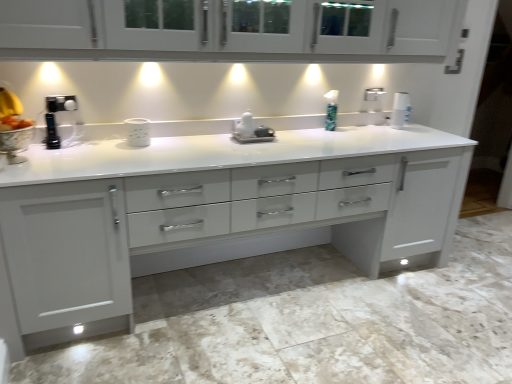
Find the location of a particular element. green plastic soap dispenser at center is located at coordinates (331, 110).

Describe the element at coordinates (232, 30) in the screenshot. I see `white glossy cabinet at upper center` at that location.

Find the location of `white glossy cabinet at upper center`. white glossy cabinet at upper center is located at coordinates (232, 30).

What is the approximate width of white glossy mug at center, the 1th appliance in the front-to-back sequence?

14.71 centimeters.

The width and height of the screenshot is (512, 384). Identify the location of white glossy paper towel at upper right. (400, 110).

Do you think white glossy coffee maker at center, which ranks as the 2th appliance in left-to-right order, is within white glossy countertop at center, or outside of it?

white glossy coffee maker at center, which ranks as the 2th appliance in left-to-right order, is inside white glossy countertop at center.

The height and width of the screenshot is (384, 512). I want to click on the 2nd appliance behind the white glossy countertop at center, so click(x=251, y=130).

From a real-world perspective, is white glossy coffee maker at center, the 1th appliance viewed from the back, located beneath white glossy countertop at center?

No, from a real-world perspective, white glossy coffee maker at center, the 1th appliance viewed from the back, is not beneath white glossy countertop at center.

Which is more to the left, white glossy coffee maker at center, acting as the second appliance starting from the front, or white glossy countertop at center?

white glossy coffee maker at center, acting as the second appliance starting from the front.

Would you say white glossy mug at center, which ranks as the 1th appliance in left-to-right order, contains white glossy cabinet at upper center?

That's incorrect, white glossy cabinet at upper center is not inside white glossy mug at center, which ranks as the 1th appliance in left-to-right order.

Which is more to the left, white glossy mug at center, which is the second appliance in right-to-left order, or white glossy cabinet at upper center?

Positioned to the left is white glossy mug at center, which is the second appliance in right-to-left order.

Is point (144, 142) closer to camera compared to point (414, 50)?

Yes, point (144, 142) is closer to viewer.

From a real-world perspective, who is located lower, white glossy cabinet at upper center or white glossy countertop at center?

In real-world perspective, white glossy countertop at center is lower.

From the picture: How distant is white glossy cabinet at upper center from white glossy countertop at center?

white glossy cabinet at upper center and white glossy countertop at center are 21.55 inches apart.

Between white glossy cabinet at upper center and white glossy countertop at center, which one has larger size?

white glossy countertop at center is bigger.

In the scene shown: Considering the sizes of white glossy cabinet at upper center and white glossy countertop at center in the image, is white glossy cabinet at upper center taller or shorter than white glossy countertop at center?

Clearly, white glossy cabinet at upper center is shorter compared to white glossy countertop at center.

Is white glossy countertop at center oriented away from green plastic soap dispenser at center?

No, white glossy countertop at center is not facing away from green plastic soap dispenser at center.

What's the angular difference between white glossy countertop at center and green plastic soap dispenser at center's facing directions?

The facing directions of white glossy countertop at center and green plastic soap dispenser at center are 4.13 degrees apart.

Consider the image. From a real-world perspective, who is located higher, white glossy countertop at center or green plastic soap dispenser at center?

green plastic soap dispenser at center.

Does white glossy paper towel at upper right turn towards green plastic soap dispenser at center?

No.

From a real-world perspective, is white glossy paper towel at upper right on top of green plastic soap dispenser at center?

Incorrect, from a real-world perspective, white glossy paper towel at upper right is lower than green plastic soap dispenser at center.

From the picture: Is white glossy countertop at center far away from white glossy mug at center, the 1th appliance in the front-to-back sequence?

Actually, white glossy countertop at center and white glossy mug at center, the 1th appliance in the front-to-back sequence, are a little close together.

Is point (154, 139) in front of point (144, 129)?

No, it is not.

From the image's perspective, which one is positioned lower, white glossy countertop at center or white glossy mug at center, the 1th appliance in the front-to-back sequence?

white glossy countertop at center, from the image's perspective.

Identify the location of the 1st appliance directly above the white glossy countertop at center (from a real-world perspective). (138, 132).

From the image's perspective, which is below, white glossy coffee maker at center, acting as the second appliance starting from the front, or white glossy paper towel at upper right?

white glossy coffee maker at center, acting as the second appliance starting from the front.

Is white glossy coffee maker at center, the 1th appliance viewed from the back, at the right side of white glossy paper towel at upper right?

In fact, white glossy coffee maker at center, the 1th appliance viewed from the back, is to the left of white glossy paper towel at upper right.

From the image's perspective, which appliance is the 1st one below the white glossy paper towel at upper right? Please provide its 2D coordinates.

[(251, 130)]

From the white glossy countertop at center, count the 1st appliance to the left and point to it. Please provide its 2D coordinates.

[(251, 130)]

There is a white glossy mug at center, which is the second appliance in right-to-left order. Where is `cabinetry above it (from a real-world perspective)`? The image size is (512, 384). cabinetry above it (from a real-world perspective) is located at coordinates (232, 30).

Estimate the real-world distances between objects in this image. Which object is closer to white glossy coffee maker at center, which ranks as the 2th appliance in left-to-right order, white glossy mug at center, positioned as the 2th appliance in back-to-front order, or green plastic soap dispenser at center?

Based on the image, green plastic soap dispenser at center appears to be nearer to white glossy coffee maker at center, which ranks as the 2th appliance in left-to-right order.

Based on their spatial positions, is white glossy paper towel at upper right or white glossy mug at center, which is the second appliance in right-to-left order, closer to white glossy countertop at center?

white glossy mug at center, which is the second appliance in right-to-left order, is positioned closer to the anchor white glossy countertop at center.

Looking at the image, which one is located closer to white glossy countertop at center, white glossy cabinet at upper center or white glossy mug at center, which ranks as the 1th appliance in left-to-right order?

The object closer to white glossy countertop at center is white glossy cabinet at upper center.

Looking at the image, which one is located further to white glossy countertop at center, white glossy paper towel at upper right or white glossy coffee maker at center, which appears as the 1th appliance when viewed from the right?

white glossy paper towel at upper right.

Which object lies nearer to the anchor point green plastic soap dispenser at center, white glossy mug at center, which is the second appliance in right-to-left order, or white glossy paper towel at upper right?

white glossy paper towel at upper right is closer to green plastic soap dispenser at center.

Based on their spatial positions, is white glossy coffee maker at center, acting as the second appliance starting from the front, or white glossy paper towel at upper right further from white glossy mug at center, the 1th appliance in the front-to-back sequence?

The object further to white glossy mug at center, the 1th appliance in the front-to-back sequence, is white glossy paper towel at upper right.

Considering their positions, is white glossy paper towel at upper right positioned closer to white glossy cabinet at upper center than white glossy coffee maker at center, the 1th appliance viewed from the back?

white glossy coffee maker at center, the 1th appliance viewed from the back.

Estimate the real-world distances between objects in this image. Which object is further from white glossy mug at center, the 1th appliance in the front-to-back sequence, white glossy cabinet at upper center or white glossy coffee maker at center, which ranks as the 2th appliance in left-to-right order?

Among the two, white glossy cabinet at upper center is located further to white glossy mug at center, the 1th appliance in the front-to-back sequence.

Where is `appliance between white glossy cabinet at upper center and white glossy coffee maker at center, acting as the second appliance starting from the front, in the front-back direction`? appliance between white glossy cabinet at upper center and white glossy coffee maker at center, acting as the second appliance starting from the front, in the front-back direction is located at coordinates (138, 132).

This screenshot has height=384, width=512. Find the location of `appliance between white glossy mug at center, which is the second appliance in right-to-left order, and white glossy paper towel at upper right from left to right`. appliance between white glossy mug at center, which is the second appliance in right-to-left order, and white glossy paper towel at upper right from left to right is located at coordinates (251, 130).

In order to click on countertop between white glossy cabinet at upper center and white glossy paper towel at upper right along the z-axis in this screenshot , I will do `click(213, 151)`.

Identify the location of soap dispenser positioned between white glossy cabinet at upper center and white glossy paper towel at upper right from near to far. (331, 110).